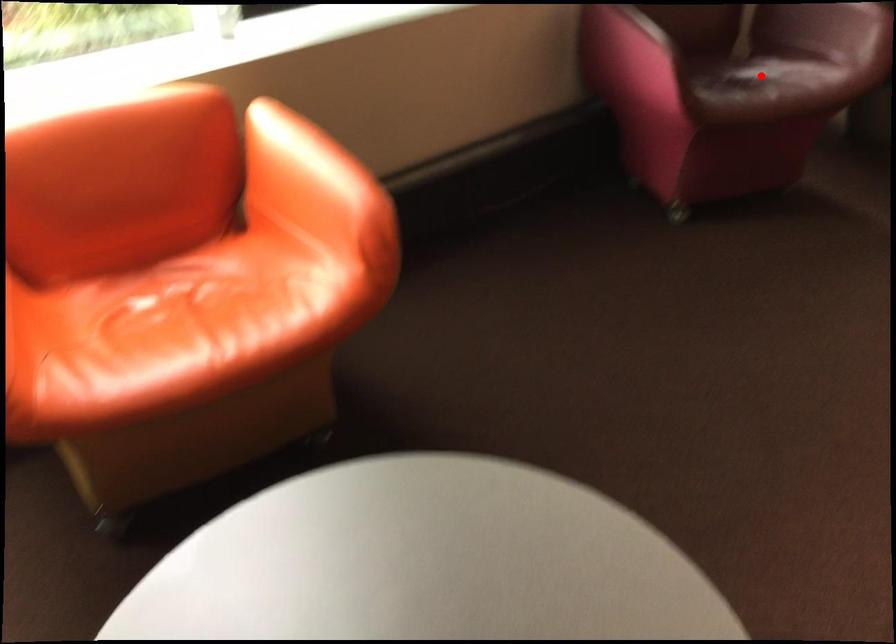
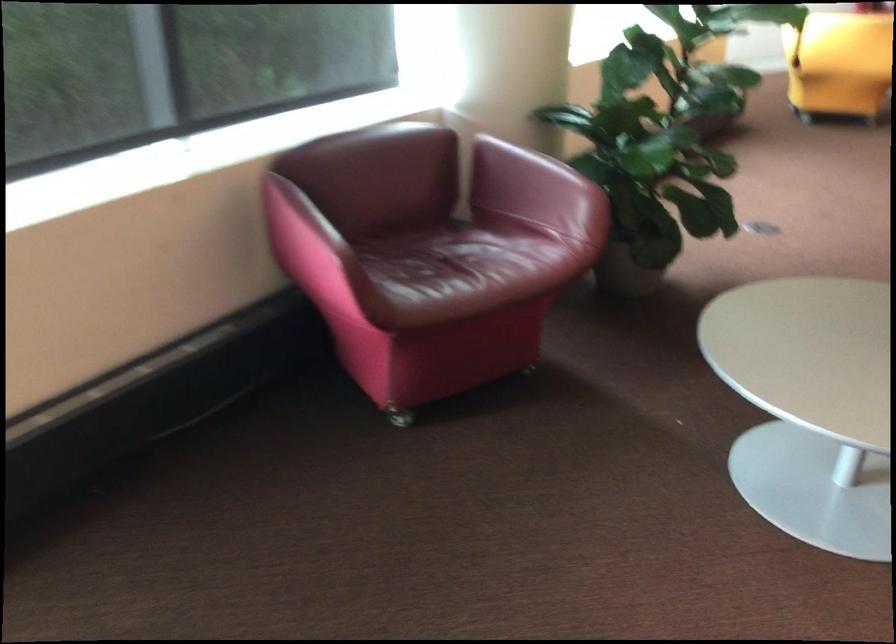
Question: I am providing you with two images of the same scene from different viewpoints. Image1 has a red point marked. In image2, the corresponding 3D location appears at what relative position? Reply with the corresponding letter.

Choices:
 (A) Closer
 (B) Farther

Answer: (A)